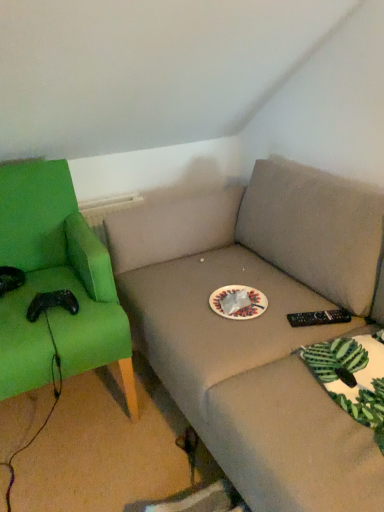
Question: Is white paper plate at center taller than green fabric chair at left?

Choices:
 (A) yes
 (B) no

Answer: (B)

Question: Would you say green fabric chair at left is part of white paper plate at center's contents?

Choices:
 (A) no
 (B) yes

Answer: (A)

Question: Is white paper plate at center at the right side of green fabric chair at left?

Choices:
 (A) yes
 (B) no

Answer: (A)

Question: Can you confirm if white paper plate at center is positioned to the left of green fabric chair at left?

Choices:
 (A) no
 (B) yes

Answer: (A)

Question: Is white paper plate at center bigger than green fabric chair at left?

Choices:
 (A) no
 (B) yes

Answer: (A)

Question: From a real-world perspective, is white paper plate at center positioned over green fabric chair at left based on gravity?

Choices:
 (A) no
 (B) yes

Answer: (B)

Question: Can you confirm if green fabric chair at left is smaller than white paper plate at center?

Choices:
 (A) no
 (B) yes

Answer: (A)

Question: Does green fabric chair at left turn towards white paper plate at center?

Choices:
 (A) no
 (B) yes

Answer: (A)

Question: Is green fabric chair at left further to the viewer compared to white paper plate at center?

Choices:
 (A) yes
 (B) no

Answer: (B)

Question: From the image's perspective, is green fabric chair at left under white paper plate at center?

Choices:
 (A) yes
 (B) no

Answer: (A)

Question: Is white paper plate at center surrounded by green fabric chair at left?

Choices:
 (A) yes
 (B) no

Answer: (B)

Question: Is green fabric chair at left wider than white paper plate at center?

Choices:
 (A) yes
 (B) no

Answer: (A)

Question: Looking at their shapes, would you say green fabric chair at left is wider or thinner than white paper plate at center?

Choices:
 (A) thin
 (B) wide

Answer: (B)